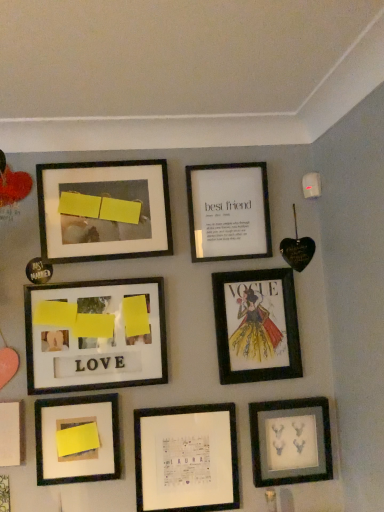
Question: Is matte paper vogue cover at center right, the 7th picture frame from the bottom, wider than matte black frame at upper left, which is counted as the first picture frame, starting from the bottom?

Choices:
 (A) yes
 (B) no

Answer: (B)

Question: Is matte paper vogue cover at center right, the 7th picture frame from the bottom, to the right of matte black frame at upper left, which is counted as the first picture frame, starting from the bottom, from the viewer's perspective?

Choices:
 (A) yes
 (B) no

Answer: (A)

Question: From the image's perspective, is matte paper vogue cover at center right, positioned as the 3th picture frame in top-to-bottom order, over matte black frame at upper left, arranged as the 9th picture frame when viewed from the top?

Choices:
 (A) yes
 (B) no

Answer: (A)

Question: Considering the relative sizes of matte paper vogue cover at center right, the 7th picture frame from the bottom, and matte black frame at upper left, which is counted as the first picture frame, starting from the bottom, in the image provided, is matte paper vogue cover at center right, the 7th picture frame from the bottom, taller than matte black frame at upper left, which is counted as the first picture frame, starting from the bottom,?

Choices:
 (A) no
 (B) yes

Answer: (B)

Question: Is there a large distance between matte paper vogue cover at center right, the 7th picture frame from the bottom, and matte black frame at upper left, which is counted as the first picture frame, starting from the bottom?

Choices:
 (A) yes
 (B) no

Answer: (B)

Question: Does matte paper vogue cover at center right, the 7th picture frame from the bottom, have a lesser width compared to matte black frame at upper left, which is counted as the first picture frame, starting from the bottom?

Choices:
 (A) yes
 (B) no

Answer: (A)

Question: Does white paper at center, arranged as the 8th picture frame when viewed from the top, have a smaller size compared to matte yellow sticky note at lower left, marked as the 4th picture frame in a bottom-to-top arrangement?

Choices:
 (A) yes
 (B) no

Answer: (A)

Question: Is white paper at center, arranged as the 8th picture frame when viewed from the top, thinner than matte yellow sticky note at lower left, placed as the 6th picture frame when sorted from top to bottom?

Choices:
 (A) no
 (B) yes

Answer: (B)

Question: Is white paper at center, which appears as the second picture frame when ordered from the bottom, touching matte yellow sticky note at lower left, placed as the 6th picture frame when sorted from top to bottom?

Choices:
 (A) yes
 (B) no

Answer: (B)

Question: Is white paper at center, which appears as the second picture frame when ordered from the bottom, bigger than matte yellow sticky note at lower left, marked as the 4th picture frame in a bottom-to-top arrangement?

Choices:
 (A) no
 (B) yes

Answer: (A)

Question: Is white paper at center, which appears as the second picture frame when ordered from the bottom, further to camera compared to matte yellow sticky note at lower left, marked as the 4th picture frame in a bottom-to-top arrangement?

Choices:
 (A) no
 (B) yes

Answer: (B)

Question: Is white paper at center, which appears as the second picture frame when ordered from the bottom, at the right side of matte yellow sticky note at lower left, marked as the 4th picture frame in a bottom-to-top arrangement?

Choices:
 (A) yes
 (B) no

Answer: (A)

Question: Can you confirm if matte paper vogue cover at center right, the 7th picture frame from the bottom, is wider than matte yellow paper at center left, the 4th picture frame viewed from the top?

Choices:
 (A) no
 (B) yes

Answer: (A)